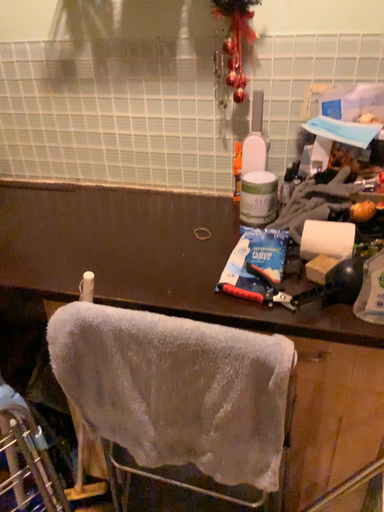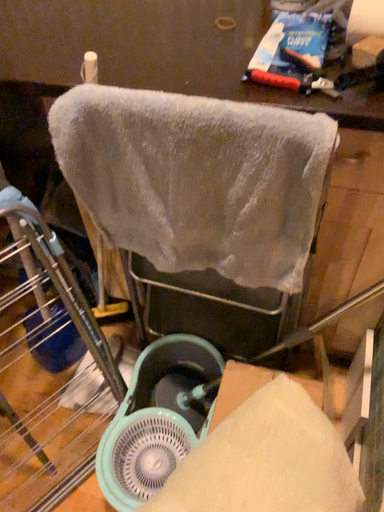
Question: Which way did the camera rotate in the video?

Choices:
 (A) rotated downward
 (B) rotated upward

Answer: (A)